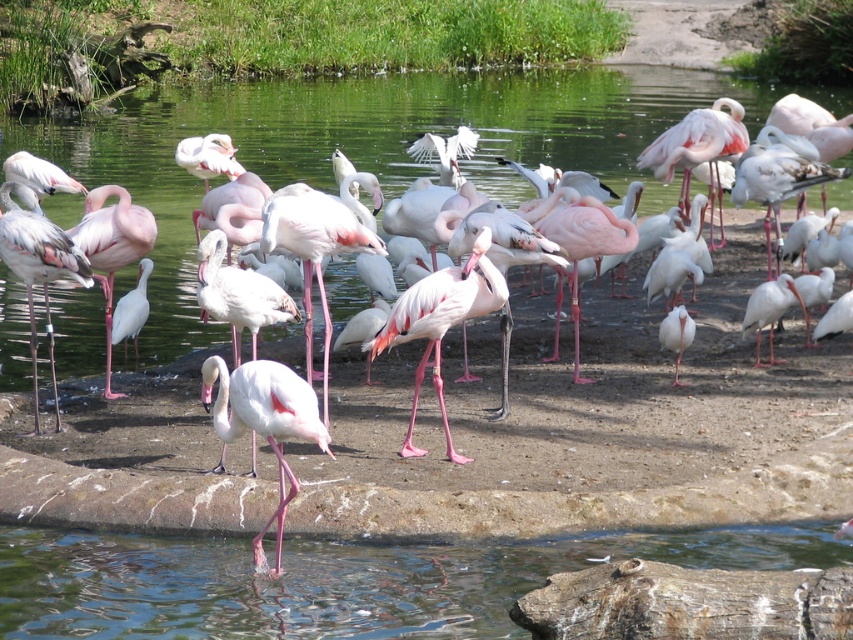
Question: Which point is closer to the camera?

Choices:
 (A) (196, 145)
 (B) (787, 282)
 (C) (595, 122)
 (D) (438, 358)

Answer: (D)

Question: Among these points, which one is farthest from the camera?

Choices:
 (A) 677,316
 (B) 759,305
 (C) 128,312
 (D) 16,234

Answer: (C)

Question: Is transparent water at center above white glossy ibis at center?

Choices:
 (A) yes
 (B) no

Answer: (A)

Question: Is transparent water at center to the right of pink matte flamingo at upper center from the viewer's perspective?

Choices:
 (A) yes
 (B) no

Answer: (A)

Question: Is pink matte flamingo at center closer to the viewer compared to white matte bird at center-right?

Choices:
 (A) no
 (B) yes

Answer: (B)

Question: Which object is closer to the camera taking this photo?

Choices:
 (A) pink matte flamingo at upper center
 (B) matte pink flamingo at center

Answer: (B)